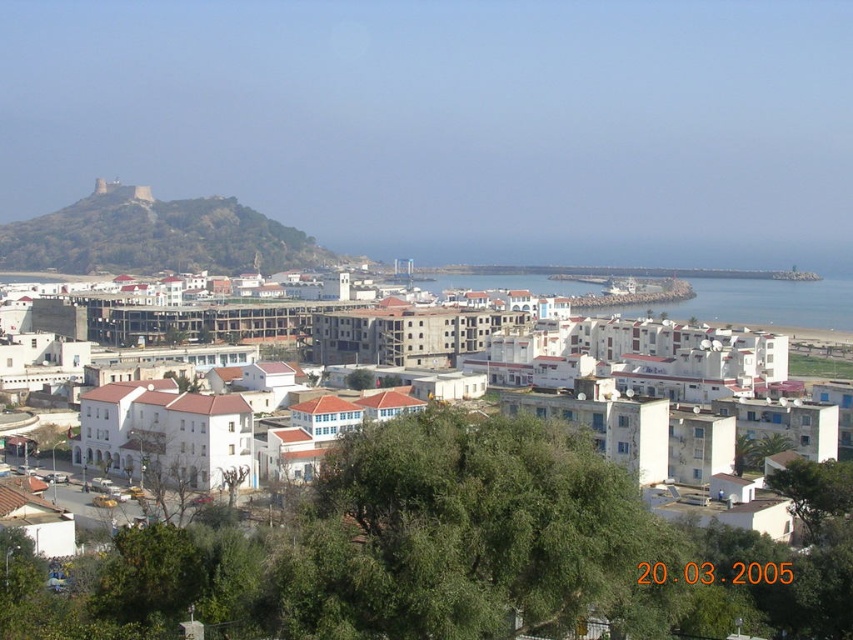
Measure the distance from white matte building at center to blue water at center.

white matte building at center and blue water at center are 30.03 meters apart.

Can you confirm if white matte building at center is thinner than blue water at center?

In fact, white matte building at center might be wider than blue water at center.

Describe the element at coordinates (770, 314) in the screenshot. I see `white matte building at center` at that location.

I want to click on white matte building at center, so click(770, 314).

Is brown rocky hillside at upper left wider than blue water at center?

No, brown rocky hillside at upper left is not wider than blue water at center.

The width and height of the screenshot is (853, 640). What do you see at coordinates (155, 236) in the screenshot?
I see `brown rocky hillside at upper left` at bounding box center [155, 236].

Who is more forward, (270, 225) or (778, 323)?

Point (778, 323) is in front.

The height and width of the screenshot is (640, 853). I want to click on brown rocky hillside at upper left, so click(155, 236).

Which is more to the left, brown rocky hillside at upper left or white matte building at center?

brown rocky hillside at upper left is more to the left.

What do you see at coordinates (155, 236) in the screenshot? The width and height of the screenshot is (853, 640). I see `brown rocky hillside at upper left` at bounding box center [155, 236].

The image size is (853, 640). What are the coordinates of `brown rocky hillside at upper left` in the screenshot? It's located at (155, 236).